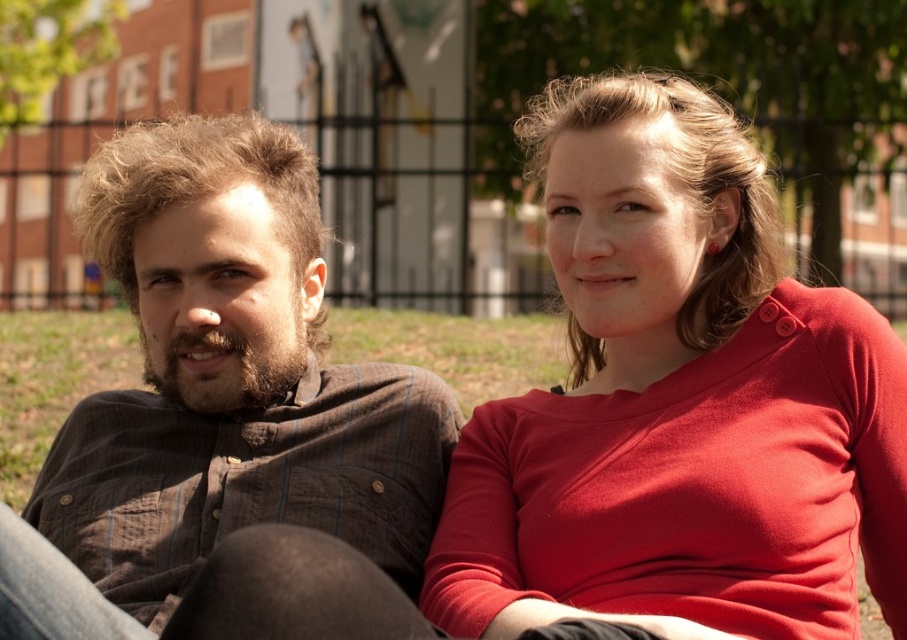
Question: Which object is closer to the camera taking this photo?

Choices:
 (A) brown striped shirt at left
 (B) matte red sweater at center

Answer: (B)

Question: Can you confirm if matte red sweater at center is positioned above brown striped shirt at left?

Choices:
 (A) no
 (B) yes

Answer: (B)

Question: Which object is closer to the camera taking this photo?

Choices:
 (A) brown striped shirt at left
 (B) matte red sweater at center

Answer: (B)

Question: Is matte red sweater at center behind brown striped shirt at left?

Choices:
 (A) yes
 (B) no

Answer: (B)

Question: Considering the relative positions of matte red sweater at center and brown striped shirt at left in the image provided, where is matte red sweater at center located with respect to brown striped shirt at left?

Choices:
 (A) below
 (B) above

Answer: (B)